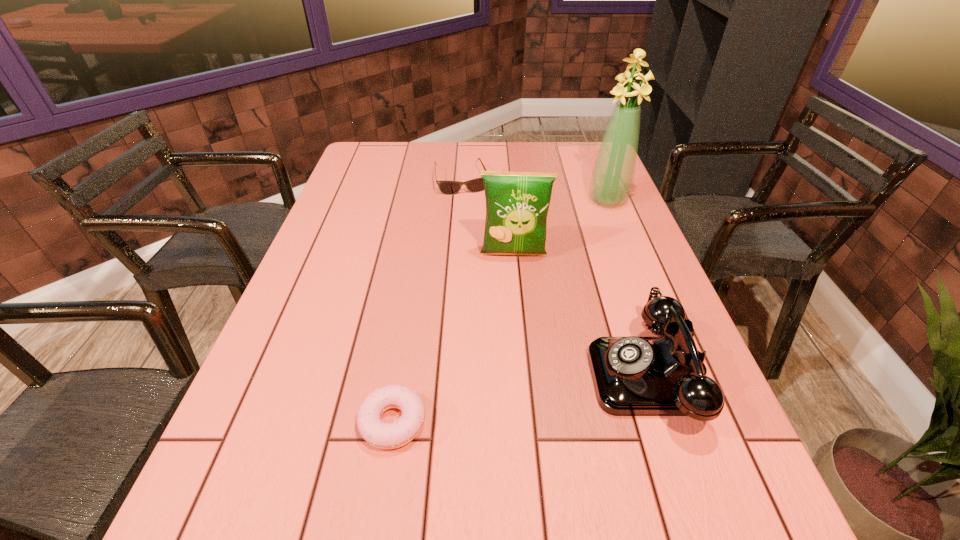
You are a GUI agent. You are given a task and a screenshot of the screen. Output one action in this format:
    pyautogui.click(x=<x>, y=<y>)
    Task: Click on the vacant space located on the lenses of the sunglasses
    
    Given the screenshot: What is the action you would take?
    pyautogui.click(x=474, y=225)

Identify the location of vacant space located 0.110m on the lenses of the sunglasses. (471, 213).

Where is `vacant space positioned on the lenses of the sunglasses`? vacant space positioned on the lenses of the sunglasses is located at coordinates (480, 243).

You are a GUI agent. You are given a task and a screenshot of the screen. Output one action in this format:
    pyautogui.click(x=<x>, y=<y>)
    Task: Click on the free spot located on the front-facing side of the fourth shortest object
    This screenshot has height=540, width=960.
    Given the screenshot: What is the action you would take?
    click(516, 380)

The height and width of the screenshot is (540, 960). What are the coordinates of `free space located 0.170m on the front-facing side of the fourth shortest object` in the screenshot? It's located at (514, 309).

Where is `free space located 0.170m on the front-facing side of the fourth shortest object`? This screenshot has width=960, height=540. free space located 0.170m on the front-facing side of the fourth shortest object is located at coordinates (514, 309).

Identify the location of free region located on the front-facing side of the tallest object. The height and width of the screenshot is (540, 960). (593, 230).

Where is `vacant space positioned on the front-facing side of the tallest object`? The width and height of the screenshot is (960, 540). vacant space positioned on the front-facing side of the tallest object is located at coordinates (586, 245).

The image size is (960, 540). I want to click on free location located on the front-facing side of the tallest object, so click(x=564, y=287).

The width and height of the screenshot is (960, 540). In order to click on object located at the far edge in this screenshot , I will do `click(475, 185)`.